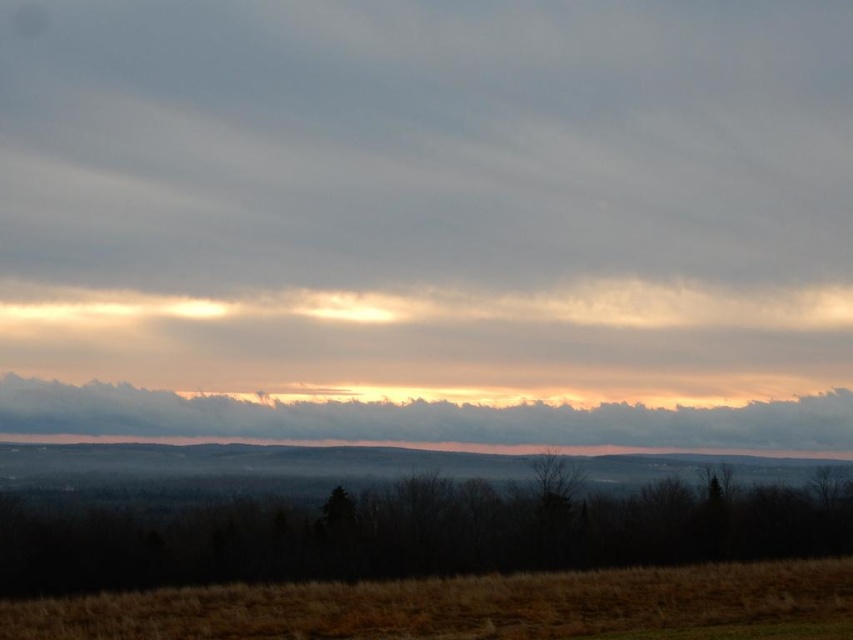
Who is more distant from viewer, (241,620) or (405,435)?

Point (405,435)

Is point (355, 624) less distant than point (250, 436)?

Yes, it is in front of point (250, 436).

Identify the location of brown grass at lower center. This screenshot has width=853, height=640. (462, 605).